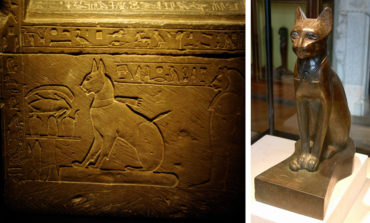
Where is `white casing`? white casing is located at coordinates (271, 152).